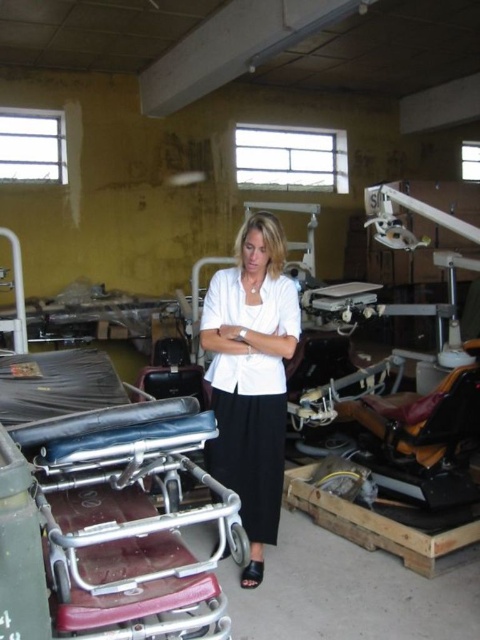
Question: Is metallic maroon hospital bed at lower left positioned behind white matte shirt at center?

Choices:
 (A) no
 (B) yes

Answer: (A)

Question: Which of the following is the closest to the observer?

Choices:
 (A) white matte shirt at center
 (B) metallic maroon hospital bed at lower left

Answer: (B)

Question: Does metallic maroon hospital bed at lower left appear on the left side of white matte shirt at center?

Choices:
 (A) no
 (B) yes

Answer: (B)

Question: Which of the following is the closest to the observer?

Choices:
 (A) metallic maroon hospital bed at lower left
 (B) white matte shirt at center

Answer: (A)

Question: Which object appears closest to the camera in this image?

Choices:
 (A) metallic maroon hospital bed at lower left
 (B) white matte shirt at center

Answer: (A)

Question: Where is metallic maroon hospital bed at lower left located in relation to white matte shirt at center in the image?

Choices:
 (A) left
 (B) right

Answer: (A)